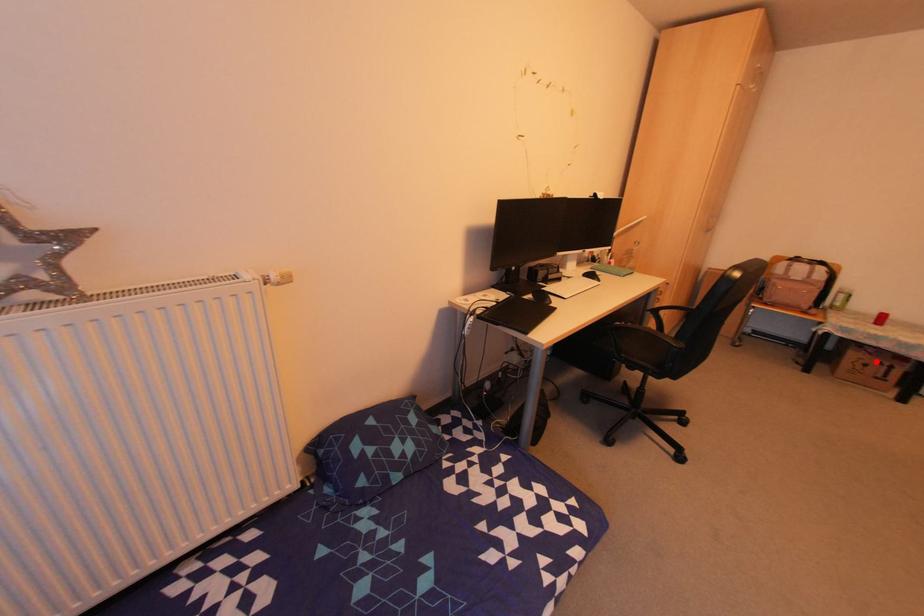
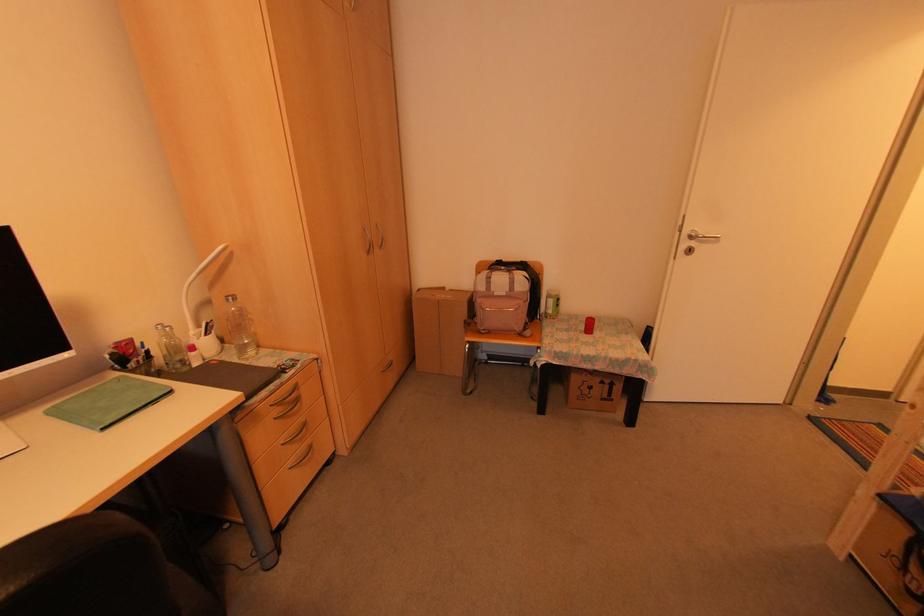
Question: I am providing you with two images of the same scene from different viewpoints. Image1 has a red point marked. In image2, the corresponding 3D location appears at what relative position? Reply with the corresponding letter.

Choices:
 (A) Closer
 (B) Farther

Answer: (B)